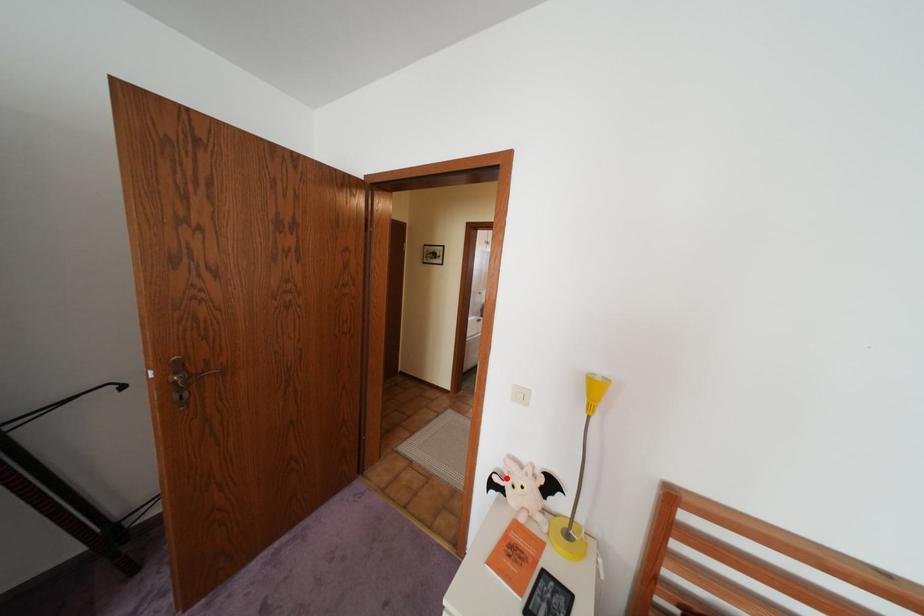
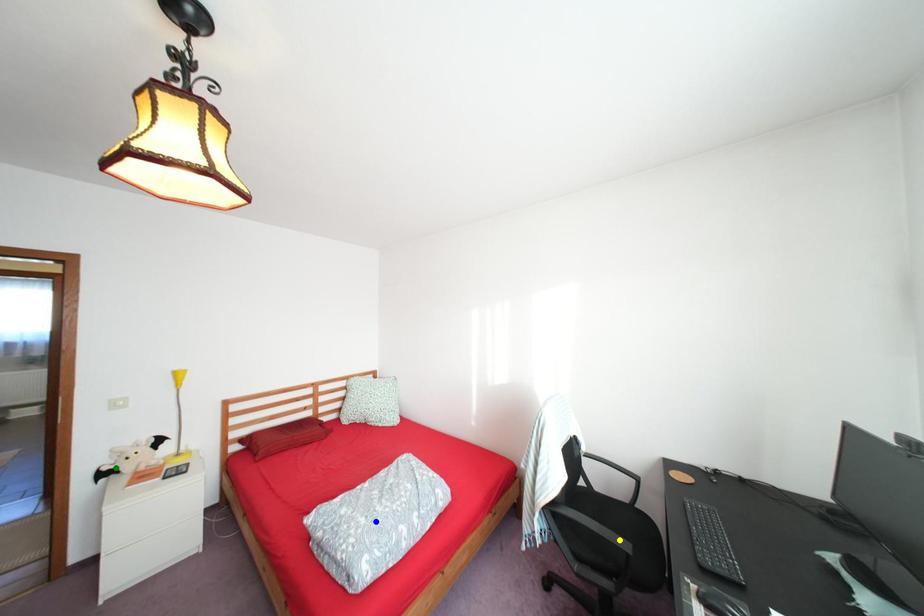
Question: I am providing you with two images of the same scene from different viewpoints. A red point is marked on the first image. You are given multiple points on the second image. Can you choose the point in image 2 that corresponds to the point in image 1?

Choices:
 (A) green point
 (B) blue point
 (C) yellow point

Answer: (A)